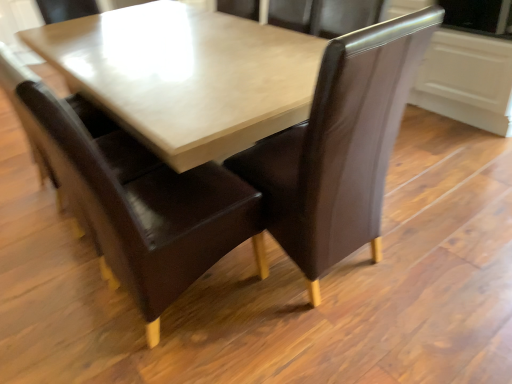
This screenshot has height=384, width=512. Find the location of `free spot to the right of brown leather chair at center, the 1th chair when ordered from right to left`. free spot to the right of brown leather chair at center, the 1th chair when ordered from right to left is located at coordinates (431, 254).